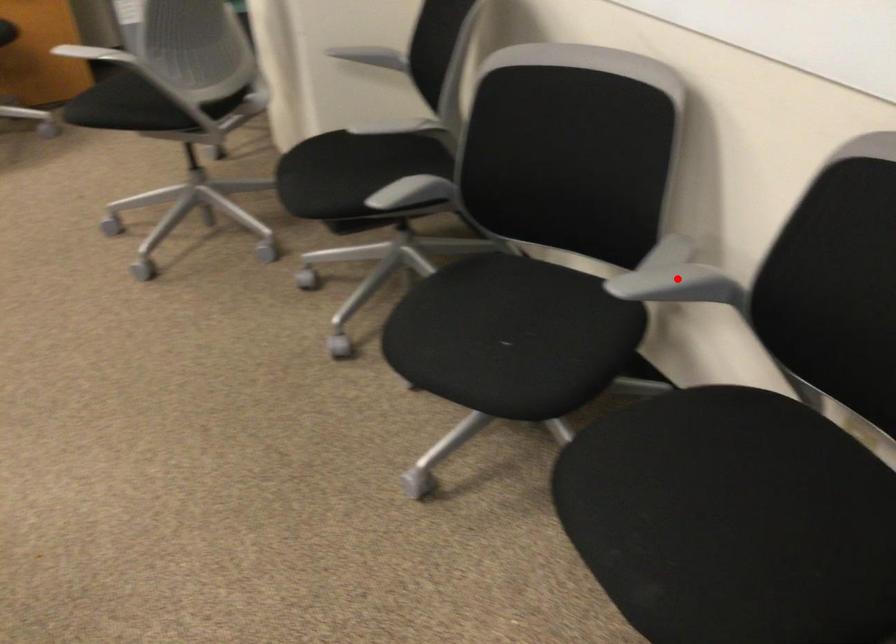
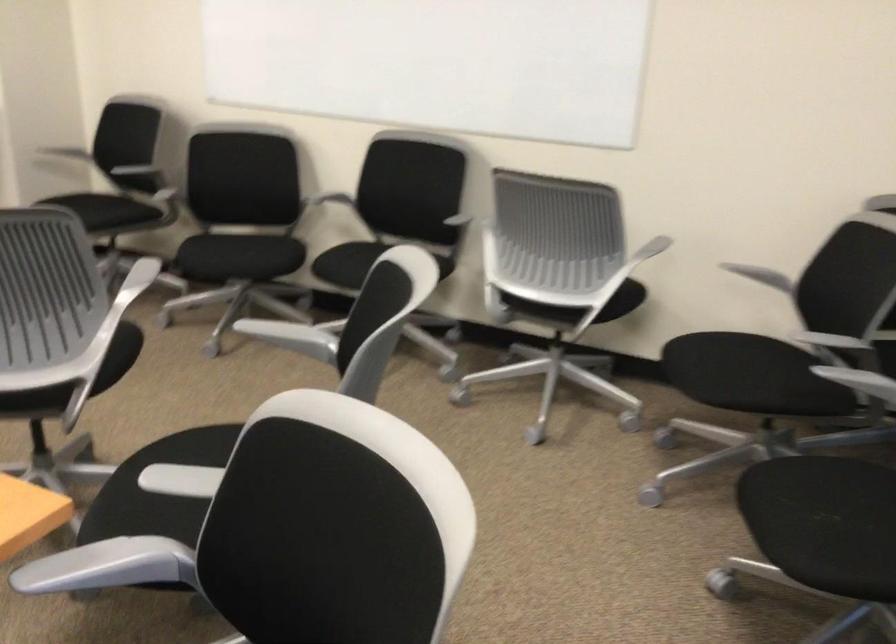
Question: I am providing you with two images of the same scene from different viewpoints. A red point is marked on the first image. At the location where the point appears in image 1, is it still visible in image 2?

Choices:
 (A) Yes
 (B) No

Answer: (B)